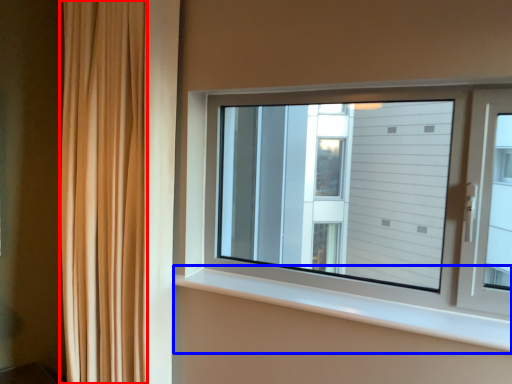
Question: Among these objects, which one is farthest to the camera, curtain (highlighted by a red box) or window sill (highlighted by a blue box)?

Choices:
 (A) curtain
 (B) window sill

Answer: (A)